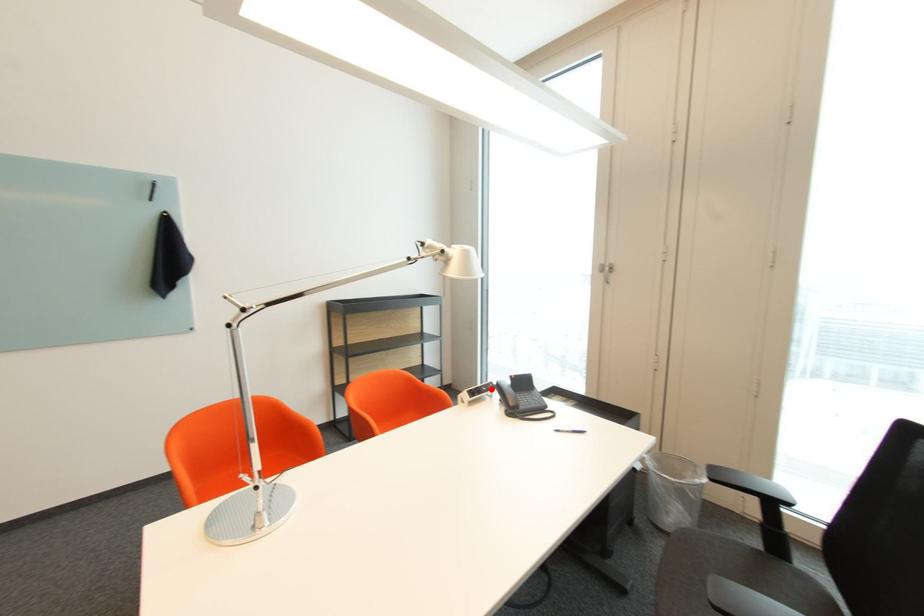
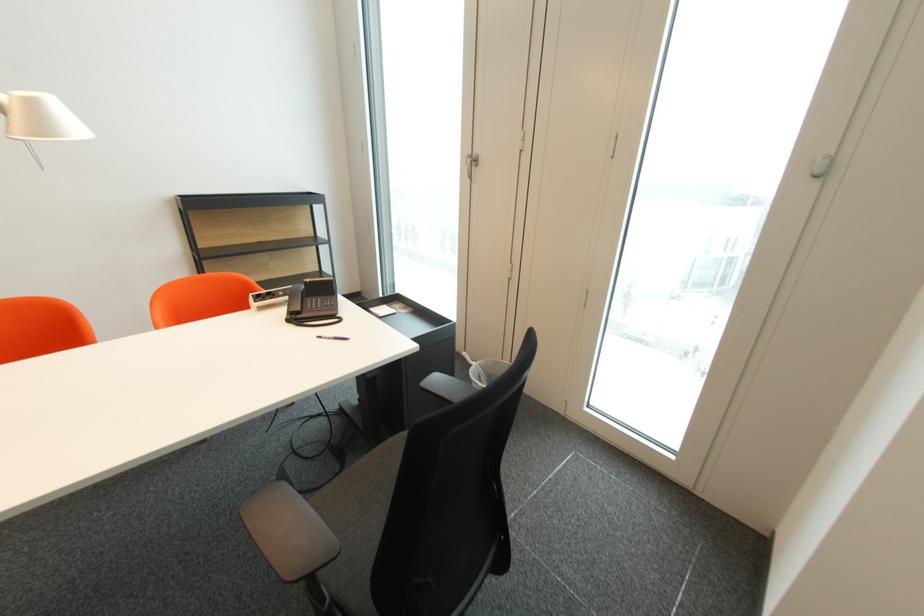
Question: I am providing you with two images of the same scene from different viewpoints. A red point is shown in image1. For the corresponding object point in image2, is it positioned nearer or farther from the camera?

Choices:
 (A) Nearer
 (B) Farther

Answer: (B)